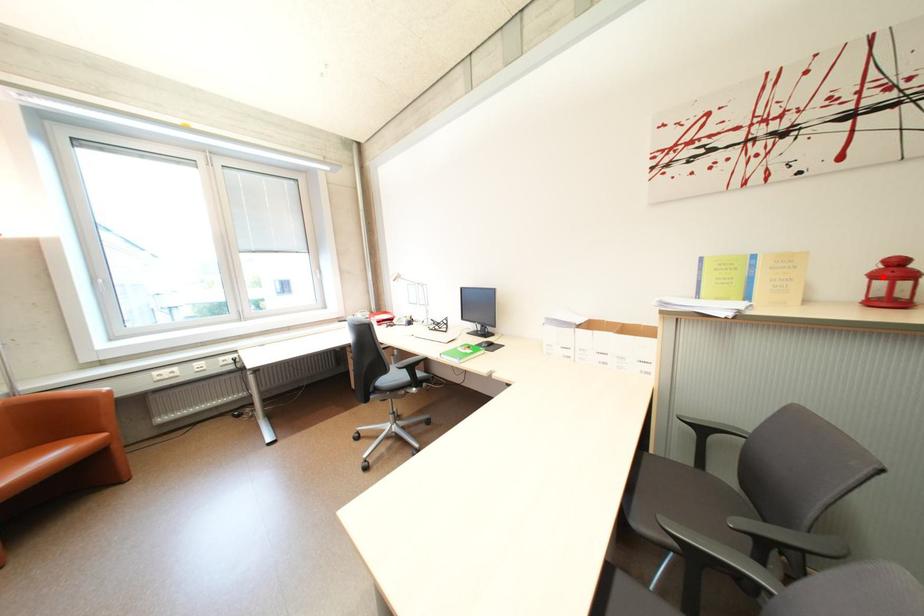
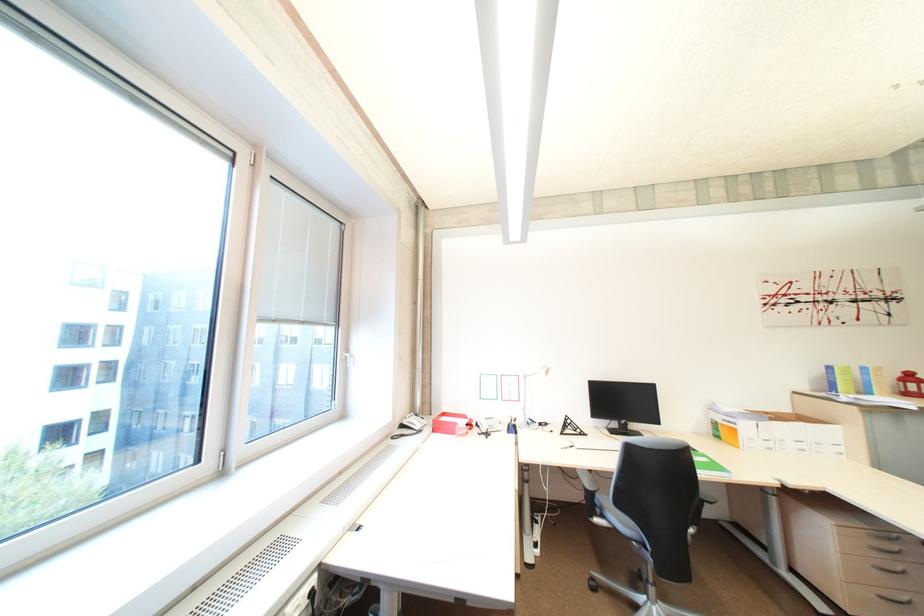
Question: I am providing you with two images of the same scene from different viewpoints. A red point is shown in image1. For the corresponding object point in image2, is it positioned nearer or farther from the camera?

Choices:
 (A) Nearer
 (B) Farther

Answer: (A)